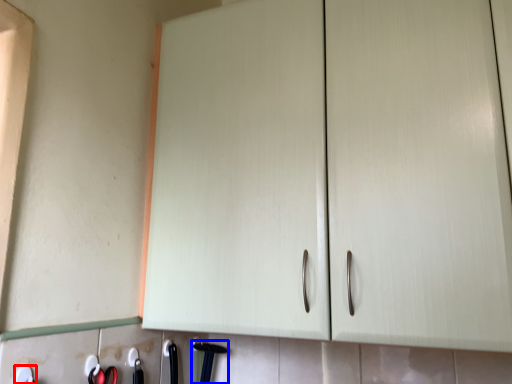
Question: Which object appears closest to the camera in this image, tool (highlighted by a red box) or door handle (highlighted by a blue box)?

Choices:
 (A) tool
 (B) door handle

Answer: (A)